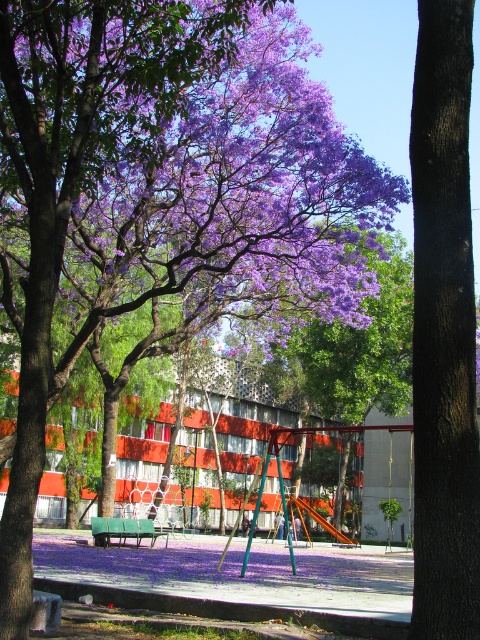
Can you confirm if purple matte tree at center is taller than green plastic bench at center?

Indeed, purple matte tree at center has a greater height compared to green plastic bench at center.

Does purple matte tree at center come behind green plastic bench at center?

Yes, purple matte tree at center is further from the viewer.

At what (x,y) coordinates should I click in order to perform the action: click on purple matte tree at center. Please return your answer as a coordinate pair (x, y). Looking at the image, I should click on tap(356, 348).

Is purple matte flower at upper center wider than brown rough bark tree at center?

Yes, purple matte flower at upper center is wider than brown rough bark tree at center.

From the picture: Does purple matte flower at upper center appear on the left side of brown rough bark tree at center?

Yes, purple matte flower at upper center is to the left of brown rough bark tree at center.

Who is more distant from viewer, (40, 141) or (477, 468)?

Point (40, 141)

The height and width of the screenshot is (640, 480). Identify the location of purple matte flower at upper center. (175, 173).

Measure the distance from brown rough bark tree at center to purple matte tree at center.

They are 127.51 feet apart.

Which of these two, brown rough bark tree at center or purple matte tree at center, stands shorter?

Standing shorter between the two is brown rough bark tree at center.

What do you see at coordinates (444, 330) in the screenshot?
I see `brown rough bark tree at center` at bounding box center [444, 330].

Locate an element on the screen. The height and width of the screenshot is (640, 480). brown rough bark tree at center is located at coordinates (444, 330).